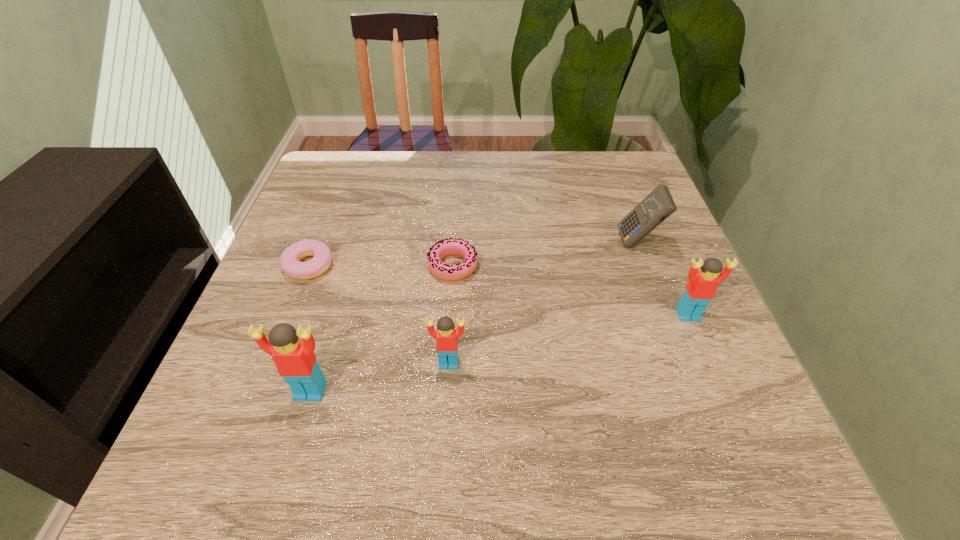
Where is `free space between the second farthest Lego and the leftmost Lego`? This screenshot has height=540, width=960. free space between the second farthest Lego and the leftmost Lego is located at coordinates (379, 377).

Where is `free space between the second shortest Lego and the calculator`? free space between the second shortest Lego and the calculator is located at coordinates (662, 278).

At what (x,y) coordinates should I click in order to perform the action: click on empty space between the right doughnut and the left doughnut. Please return your answer as a coordinate pair (x, y). Looking at the image, I should click on (381, 266).

Identify the location of vacant space that's between the calculator and the right doughnut. This screenshot has width=960, height=540. (545, 254).

This screenshot has width=960, height=540. Identify the location of vacant region between the left doughnut and the fifth farthest object. (379, 314).

Where is `vacant area that lies between the nearest object and the right doughnut`? This screenshot has width=960, height=540. vacant area that lies between the nearest object and the right doughnut is located at coordinates pyautogui.click(x=382, y=328).

In order to click on object that can be found as the third closest to the second nearest object in this screenshot , I will do `click(290, 263)`.

Choose which object is the fifth nearest neighbor to the rightmost Lego. Please provide its 2D coordinates. Your answer should be formatted as a tuple, i.e. [(x, y)], where the tuple contains the x and y coordinates of a point satisfying the conditions above.

[(290, 263)]

In order to click on the second closest Lego relative to the nearest Lego in this screenshot , I will do `click(701, 288)`.

At what (x,y) coordinates should I click in order to perform the action: click on Lego identified as the second closest to the nearest object. Please return your answer as a coordinate pair (x, y). This screenshot has height=540, width=960. Looking at the image, I should click on (701, 288).